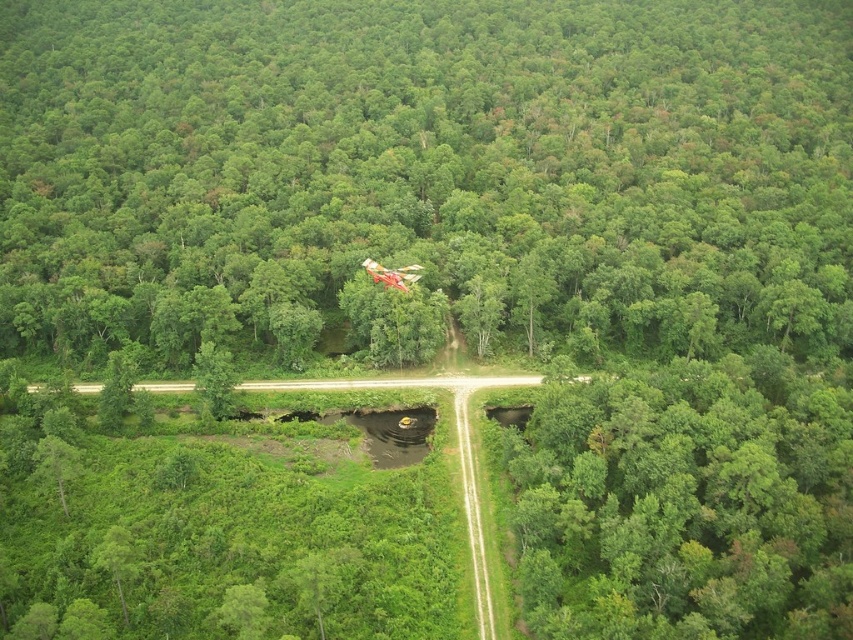
You are a drone operator trying to navigate your drone through the forest. You need to fly from the green leafy tree at lower right to the metallic red helicopter at center. Considering the height of the objects, which object will require you to adjust your flight path upwards to avoid collision?

The green leafy tree at lower right is taller than the metallic red helicopter at center, so you will need to adjust your flight path upwards when approaching the green leafy tree at lower right to avoid collision.

You are a drone operator trying to navigate a drone through this forest scene. You need to fly your drone from the green leafy tree at lower right to the metallic red helicopter at center. Which object will the drone pass closer to first?

The drone will first pass closer to the green leafy tree at lower right because it is closer to the viewer than the metallic red helicopter at center.